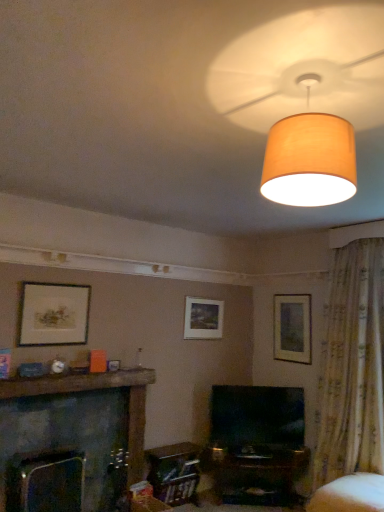
Question: Is floral fabric curtain at right looking in the opposite direction of white fabric swivel chair at lower right?

Choices:
 (A) yes
 (B) no

Answer: (B)

Question: Does floral fabric curtain at right turn towards white fabric swivel chair at lower right?

Choices:
 (A) no
 (B) yes

Answer: (B)

Question: Can you confirm if floral fabric curtain at right is wider than white fabric swivel chair at lower right?

Choices:
 (A) no
 (B) yes

Answer: (A)

Question: Is floral fabric curtain at right at the right side of white fabric swivel chair at lower right?

Choices:
 (A) yes
 (B) no

Answer: (A)

Question: Does floral fabric curtain at right have a greater height compared to white fabric swivel chair at lower right?

Choices:
 (A) no
 (B) yes

Answer: (B)

Question: Is floral fabric curtain at right smaller than white fabric swivel chair at lower right?

Choices:
 (A) yes
 (B) no

Answer: (B)

Question: Is white fabric swivel chair at lower right placed right next to matte beige lampshade at upper center?

Choices:
 (A) yes
 (B) no

Answer: (B)

Question: Does white fabric swivel chair at lower right have a lesser height compared to matte beige lampshade at upper center?

Choices:
 (A) no
 (B) yes

Answer: (B)

Question: From the image's perspective, would you say white fabric swivel chair at lower right is positioned over matte beige lampshade at upper center?

Choices:
 (A) yes
 (B) no

Answer: (B)

Question: Would you say white fabric swivel chair at lower right is a long distance from matte beige lampshade at upper center?

Choices:
 (A) no
 (B) yes

Answer: (B)

Question: Can you confirm if white fabric swivel chair at lower right is thinner than matte beige lampshade at upper center?

Choices:
 (A) yes
 (B) no

Answer: (B)

Question: From the image's perspective, is white fabric swivel chair at lower right under matte beige lampshade at upper center?

Choices:
 (A) no
 (B) yes

Answer: (B)

Question: From the image's perspective, does white fabric swivel chair at lower right appear higher than black glossy tv at center?

Choices:
 (A) yes
 (B) no

Answer: (B)